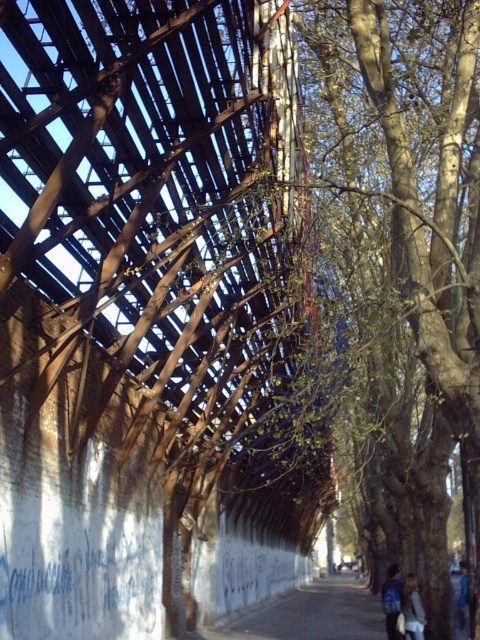
Does green leafy tree at right have a smaller size compared to blue fabric backpack at center?

Incorrect, green leafy tree at right is not smaller in size than blue fabric backpack at center.

Is the position of green leafy tree at right less distant than that of blue fabric backpack at center?

Yes, green leafy tree at right is closer to the viewer.

Is point (354, 406) positioned before point (389, 584)?

No, (354, 406) is further to viewer.

Locate an element on the screen. green leafy tree at right is located at coordinates (396, 275).

Is green leafy tree at right thinner than light brown leather jacket at lower right?

In fact, green leafy tree at right might be wider than light brown leather jacket at lower right.

Does point (456, 435) come farther from viewer compared to point (415, 608)?

No, (456, 435) is closer to viewer.

Where is `green leafy tree at right`? green leafy tree at right is located at coordinates (396, 275).

Does blue fabric backpack at center have a smaller size compared to light brown leather jacket at lower right?

No, blue fabric backpack at center is not smaller than light brown leather jacket at lower right.

Between blue fabric backpack at center and light brown leather jacket at lower right, which one is positioned lower?

blue fabric backpack at center

Does point (384, 595) come in front of point (418, 604)?

No, (384, 595) is behind (418, 604).

Where is `blue fabric backpack at center`? The height and width of the screenshot is (640, 480). blue fabric backpack at center is located at coordinates (392, 600).